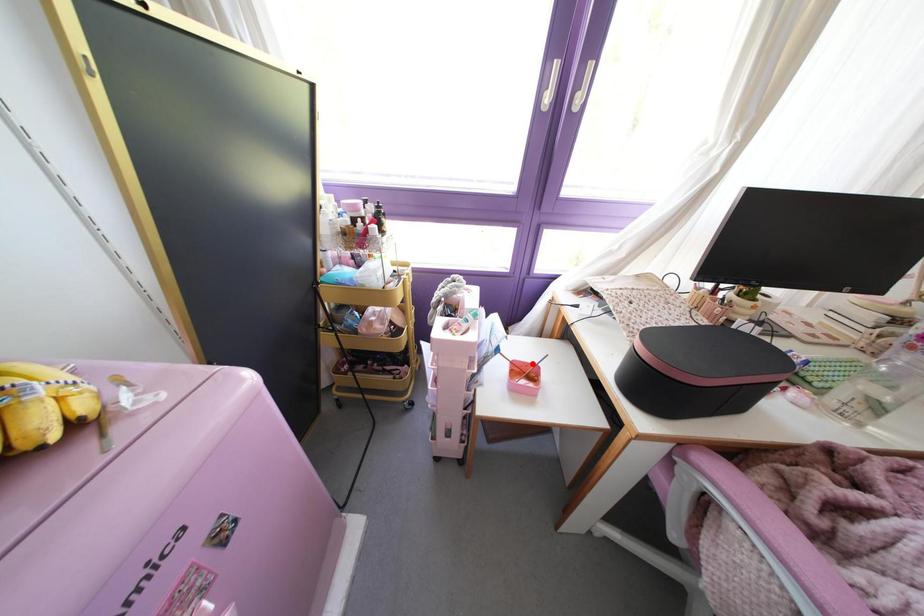
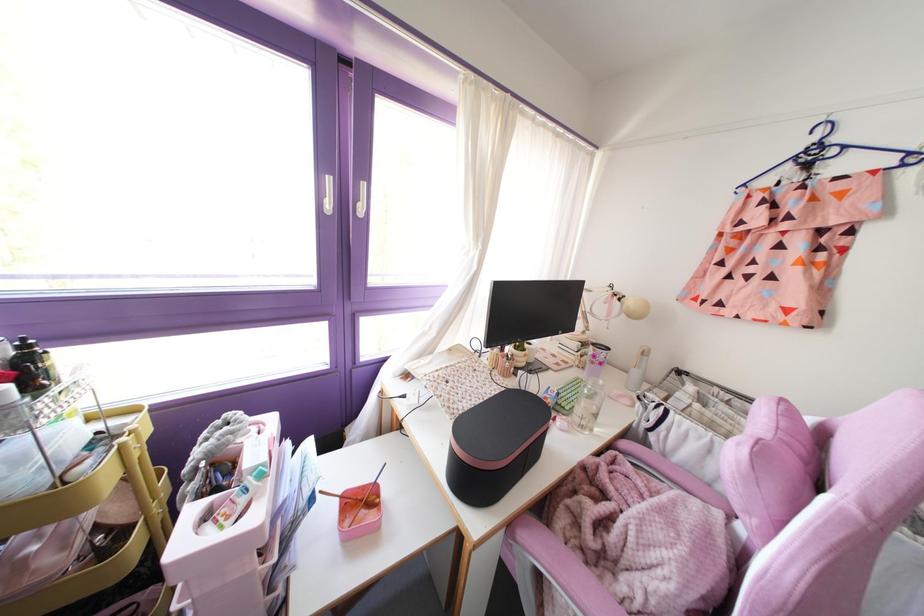
Question: I am providing you with two images of the same scene from different viewpoints. A red point is marked on the first image. Is the red point's position out of view in image 2?

Choices:
 (A) Yes
 (B) No

Answer: (B)